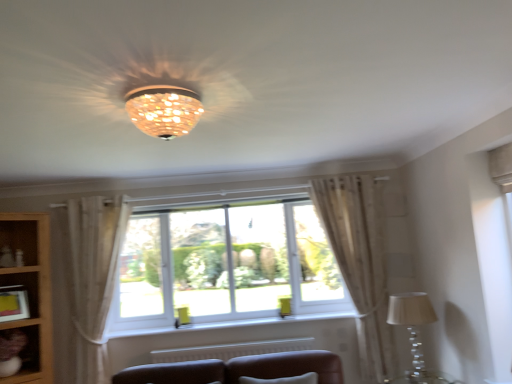
Question: Would you say white textured radiator at lower center is outside white plastic window at center?

Choices:
 (A) no
 (B) yes

Answer: (B)

Question: From the image's perspective, does white textured radiator at lower center appear higher than white plastic window at center?

Choices:
 (A) yes
 (B) no

Answer: (B)

Question: Can you confirm if white textured radiator at lower center is smaller than white plastic window at center?

Choices:
 (A) yes
 (B) no

Answer: (A)

Question: Does white textured radiator at lower center have a greater height compared to white plastic window at center?

Choices:
 (A) yes
 (B) no

Answer: (B)

Question: Are white textured radiator at lower center and white plastic window at center making contact?

Choices:
 (A) yes
 (B) no

Answer: (B)

Question: From the image's perspective, is white textured radiator at lower center below white plastic window at center?

Choices:
 (A) yes
 (B) no

Answer: (A)

Question: From a real-world perspective, does wooden bookshelf at lower left stand above matte brown shelf at lower left?

Choices:
 (A) yes
 (B) no

Answer: (A)

Question: Is wooden bookshelf at lower left completely or partially outside of matte brown shelf at lower left?

Choices:
 (A) no
 (B) yes

Answer: (B)

Question: Considering the relative sizes of wooden bookshelf at lower left and matte brown shelf at lower left in the image provided, is wooden bookshelf at lower left thinner than matte brown shelf at lower left?

Choices:
 (A) no
 (B) yes

Answer: (A)

Question: From the image's perspective, is wooden bookshelf at lower left below matte brown shelf at lower left?

Choices:
 (A) no
 (B) yes

Answer: (A)

Question: Is wooden bookshelf at lower left oriented towards matte brown shelf at lower left?

Choices:
 (A) no
 (B) yes

Answer: (B)

Question: Is wooden bookshelf at lower left turned away from matte brown shelf at lower left?

Choices:
 (A) no
 (B) yes

Answer: (B)

Question: Is sheer beige curtain at right, which is counted as the 2th curtain, starting from the left, in front of white plastic window at center?

Choices:
 (A) no
 (B) yes

Answer: (B)